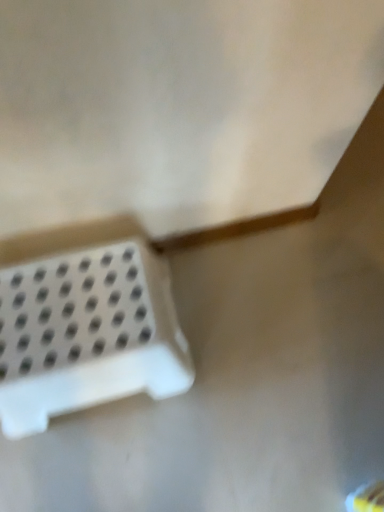
What do you see at coordinates (85, 323) in the screenshot? This screenshot has height=512, width=384. I see `white plastic power plugs and sockets at lower left` at bounding box center [85, 323].

Where is `white plastic power plugs and sockets at lower left`? The height and width of the screenshot is (512, 384). white plastic power plugs and sockets at lower left is located at coordinates point(85,323).

Identify the location of white plastic power plugs and sockets at lower left. (85, 323).